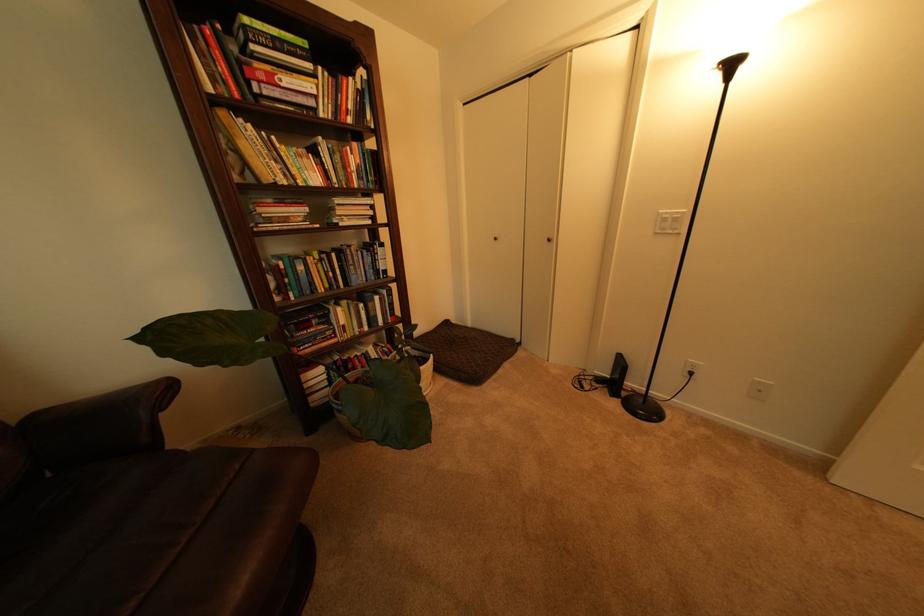
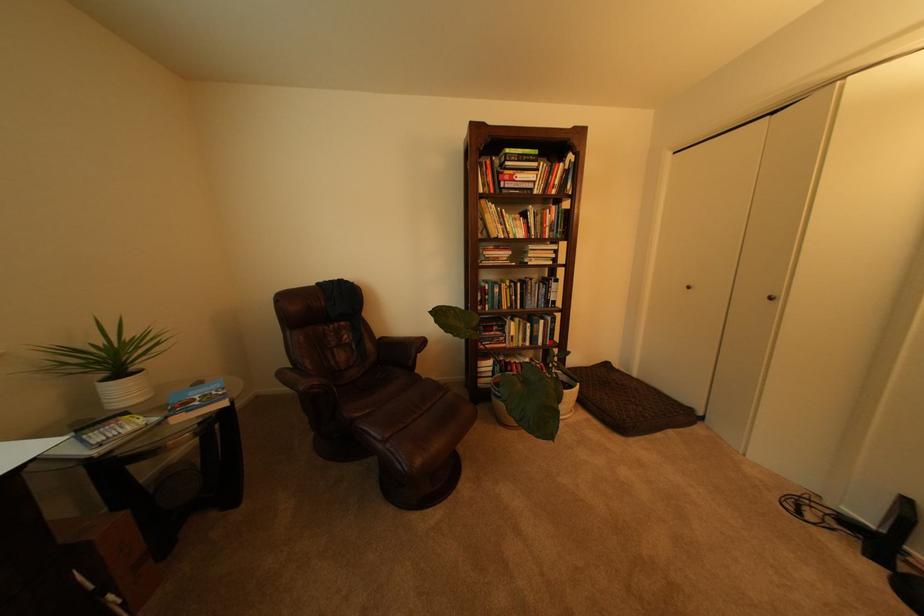
Where in the second image is the point corresponding to the point at 444,363 from the first image?

(590, 392)